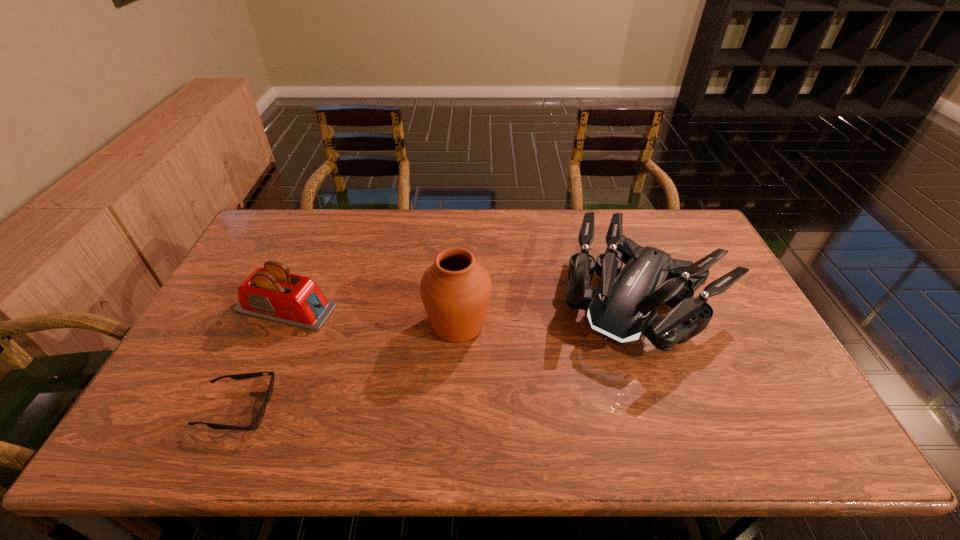
Identify the location of object that is positioned at the far edge. (625, 307).

You are a GUI agent. You are given a task and a screenshot of the screen. Output one action in this format:
    pyautogui.click(x=<x>, y=<y>)
    Task: Click on the object that is positioned at the near edge
    This screenshot has width=960, height=540.
    Given the screenshot: What is the action you would take?
    pyautogui.click(x=257, y=420)

Locate an element on the screen. The height and width of the screenshot is (540, 960). toaster that is positioned at the left edge is located at coordinates (272, 293).

At what (x,y) coordinates should I click in order to perform the action: click on sunglasses that is at the left edge. Please return your answer as a coordinate pair (x, y). Image resolution: width=960 pixels, height=540 pixels. Looking at the image, I should click on (257, 420).

You are a GUI agent. You are given a task and a screenshot of the screen. Output one action in this format:
    pyautogui.click(x=<x>, y=<y>)
    Task: Click on the object that is at the right edge
    
    Given the screenshot: What is the action you would take?
    pyautogui.click(x=625, y=307)

This screenshot has width=960, height=540. Find the location of `object present at the near left corner`. object present at the near left corner is located at coordinates (257, 420).

Find the location of `object at the far right corner`. object at the far right corner is located at coordinates (x=625, y=307).

The width and height of the screenshot is (960, 540). In order to click on vacant space at the far edge of the desktop in this screenshot , I will do [435, 209].

In the image, there is a desktop. Where is `free space at the near edge`? This screenshot has height=540, width=960. free space at the near edge is located at coordinates (506, 424).

Where is `vacant position at the left edge of the desktop`? Image resolution: width=960 pixels, height=540 pixels. vacant position at the left edge of the desktop is located at coordinates (255, 251).